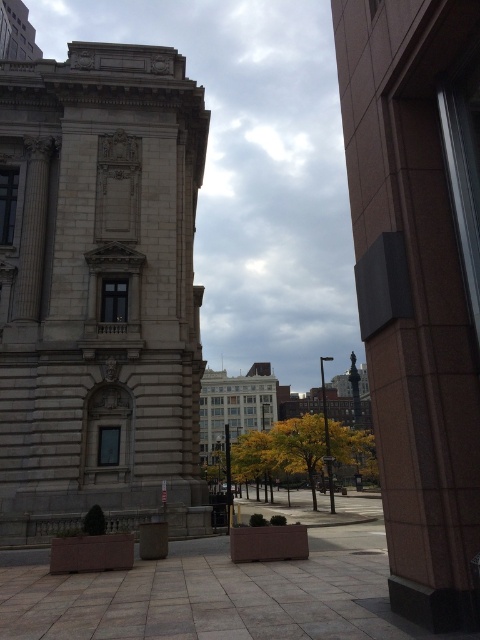
Which is above, light beige stone tower at left or yellow leafy tree at center?

light beige stone tower at left is higher up.

Between light beige stone tower at left and yellow leafy tree at center, which one is positioned lower?

yellow leafy tree at center

Is point (139, 493) in front of point (336, 472)?

Yes, point (139, 493) is closer to viewer.

You are a GUI agent. You are given a task and a screenshot of the screen. Output one action in this format:
    pyautogui.click(x=<x>, y=<y>)
    Task: Click on the light beige stone tower at left
    Image resolution: width=480 pixels, height=640 pixels.
    Given the screenshot: What is the action you would take?
    pyautogui.click(x=98, y=284)